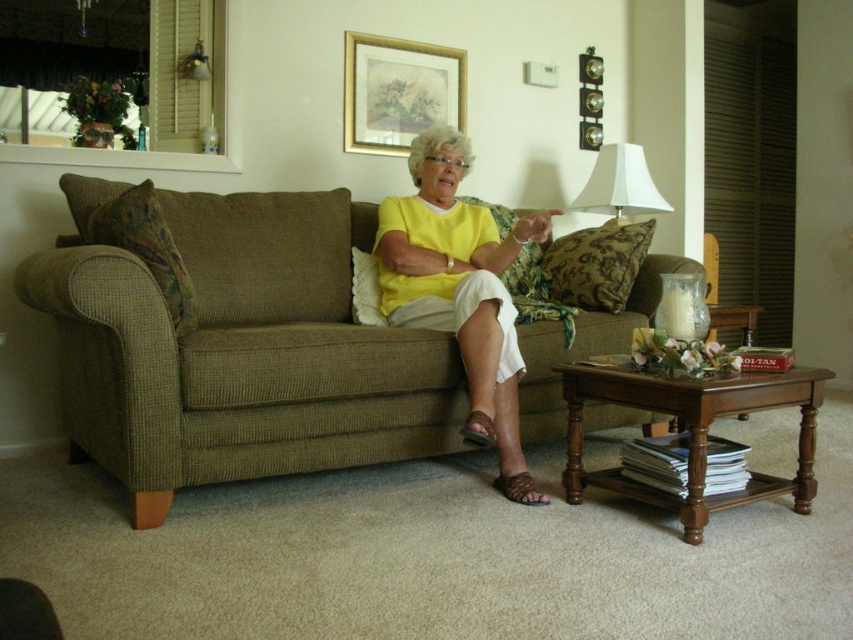
Question: Which point is closer to the camera?

Choices:
 (A) (514, 362)
 (B) (641, 164)
 (C) (363, 349)
 (D) (379, 118)

Answer: (C)

Question: Does green textured couch at center appear on the left side of white fabric lampshade at upper right?

Choices:
 (A) yes
 (B) no

Answer: (A)

Question: Is green textured couch at center thinner than yellow matte shirt at center?

Choices:
 (A) no
 (B) yes

Answer: (A)

Question: Can you confirm if green textured couch at center is thinner than white fabric lampshade at upper right?

Choices:
 (A) no
 (B) yes

Answer: (A)

Question: Among these points, which one is nearest to the camera?

Choices:
 (A) (627, 156)
 (B) (106, 376)
 (C) (402, 275)

Answer: (B)

Question: Estimate the real-world distances between objects in this image. Which object is closer to the yellow matte shirt at center?

Choices:
 (A) white fabric lampshade at upper right
 (B) gold-framed artwork at upper center
 (C) green textured couch at center

Answer: (C)